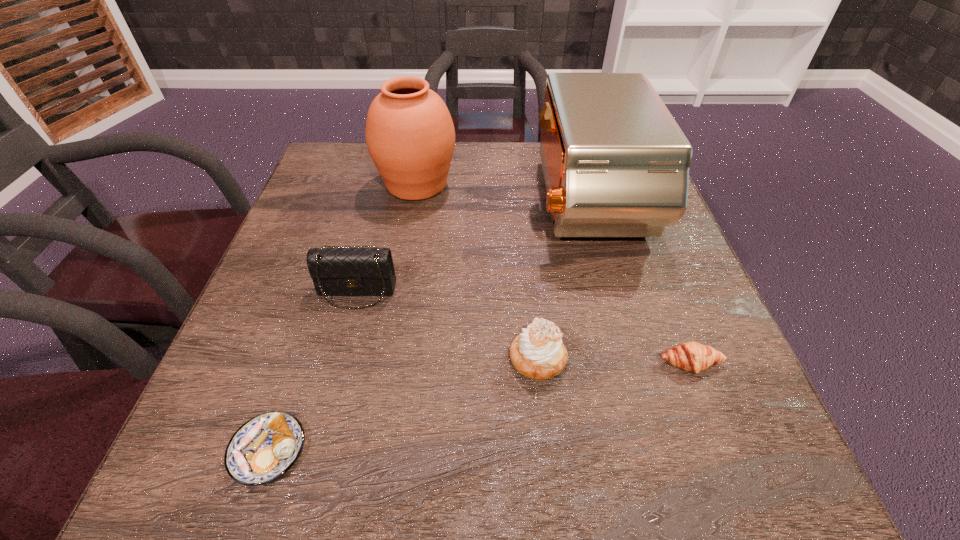
Locate an element on the screen. free point between the urn and the tallest pastry is located at coordinates (477, 272).

You are a GUI agent. You are given a task and a screenshot of the screen. Output one action in this format:
    pyautogui.click(x=<x>, y=<y>)
    Task: Click on the vacant region between the rightmost pastry and the toaster oven
    The image size is (960, 540).
    Given the screenshot: What is the action you would take?
    pyautogui.click(x=638, y=284)

Where is `vacant region between the fourth nearest object and the urn`? vacant region between the fourth nearest object and the urn is located at coordinates (387, 238).

Identify the location of vacant space that's between the clutch bag and the nearest object. 312,371.

Identify the location of free space between the second pastry from right to left and the toaster oven. (563, 282).

This screenshot has height=540, width=960. What are the coordinates of `free space that is in between the nearest pastry and the toaster oven` in the screenshot? It's located at (427, 327).

Find the location of a particular element. Image resolution: width=960 pixels, height=540 pixels. free area in between the second pastry from right to left and the urn is located at coordinates (477, 272).

Where is `free space that is in between the toaster oven and the rightmost pastry`? This screenshot has width=960, height=540. free space that is in between the toaster oven and the rightmost pastry is located at coordinates (638, 284).

Select which object is the fourth closest to the urn. Please provide its 2D coordinates. Your answer should be formatted as a tuple, i.e. [(x, y)], where the tuple contains the x and y coordinates of a point satisfying the conditions above.

[(265, 447)]

Find the location of `object that is the fifth closest to the nearest pastry`. object that is the fifth closest to the nearest pastry is located at coordinates (691, 356).